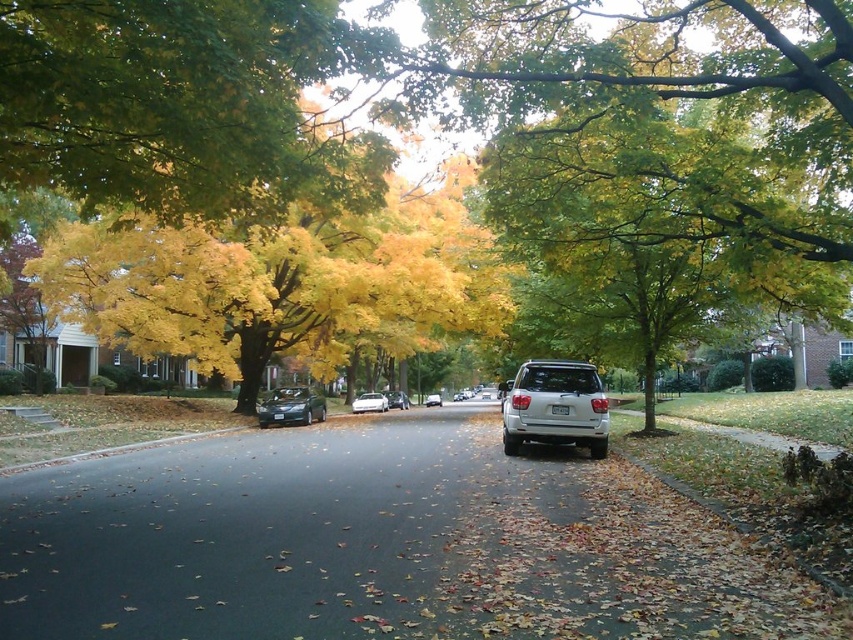
Between white matte suv at center and shiny silver sedan at center, which one has more height?

white matte suv at center is taller.

Is the position of white matte suv at center less distant than that of shiny silver sedan at center?

That is True.

I want to click on white matte suv at center, so click(x=555, y=403).

Find the location of a particular element. white matte suv at center is located at coordinates (555, 403).

Which is more to the left, yellow/golden leaves at center or satin silver sedan at center?

yellow/golden leaves at center is more to the left.

Who is lower down, yellow/golden leaves at center or satin silver sedan at center?

Positioned lower is satin silver sedan at center.

You are a GUI agent. You are given a task and a screenshot of the screen. Output one action in this format:
    pyautogui.click(x=<x>, y=<y>)
    Task: Click on the yellow/golden leaves at center
    
    Given the screenshot: What is the action you would take?
    pyautogui.click(x=282, y=284)

Is satin black sedan at center bigger than white plastic license plate at center?

Yes.

Which is more to the left, satin black sedan at center or white plastic license plate at center?

From the viewer's perspective, satin black sedan at center appears more on the left side.

Does point (436, 401) come closer to viewer compared to point (566, 413)?

No.

Image resolution: width=853 pixels, height=640 pixels. What are the coordinates of `satin black sedan at center` in the screenshot? It's located at (433, 401).